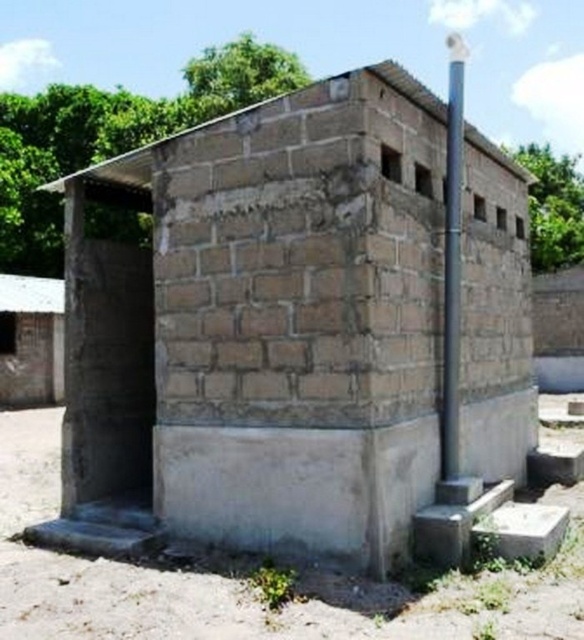
Question: Which object is positioned closest to the brick wall hut at center?

Choices:
 (A) white corrugated metal hut at left
 (B) blue metallic pole at upper right

Answer: (B)

Question: Which point is closer to the camera?

Choices:
 (A) white corrugated metal hut at left
 (B) blue metallic pole at upper right

Answer: (B)

Question: Does white corrugated metal hut at left appear on the left side of blue metallic pole at upper right?

Choices:
 (A) yes
 (B) no

Answer: (A)

Question: Does white corrugated metal hut at left have a larger size compared to blue metallic pole at upper right?

Choices:
 (A) no
 (B) yes

Answer: (A)

Question: Is brick wall hut at center in front of blue metallic pole at upper right?

Choices:
 (A) yes
 (B) no

Answer: (A)

Question: Which object appears farthest from the camera in this image?

Choices:
 (A) blue metallic pole at upper right
 (B) brick wall hut at center
 (C) white corrugated metal hut at left

Answer: (C)